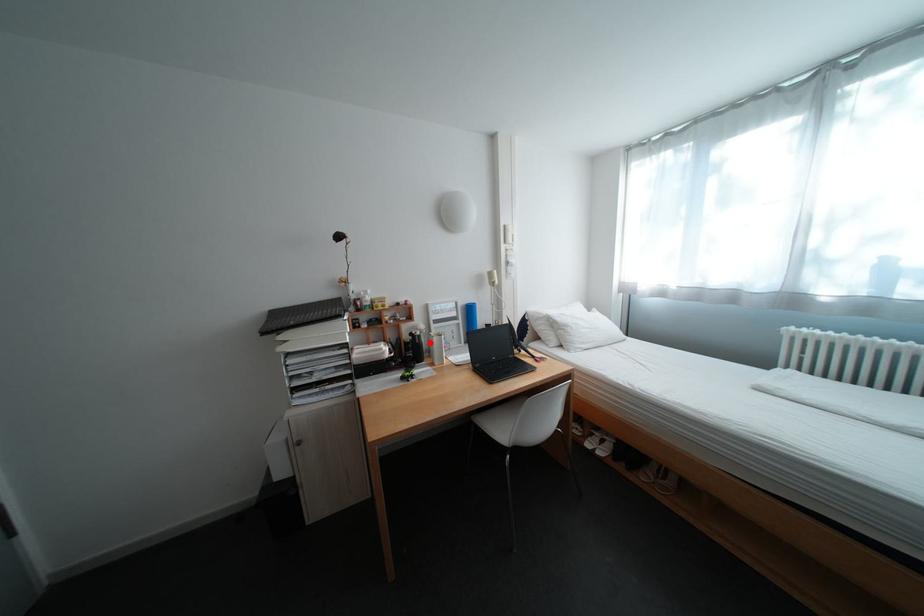
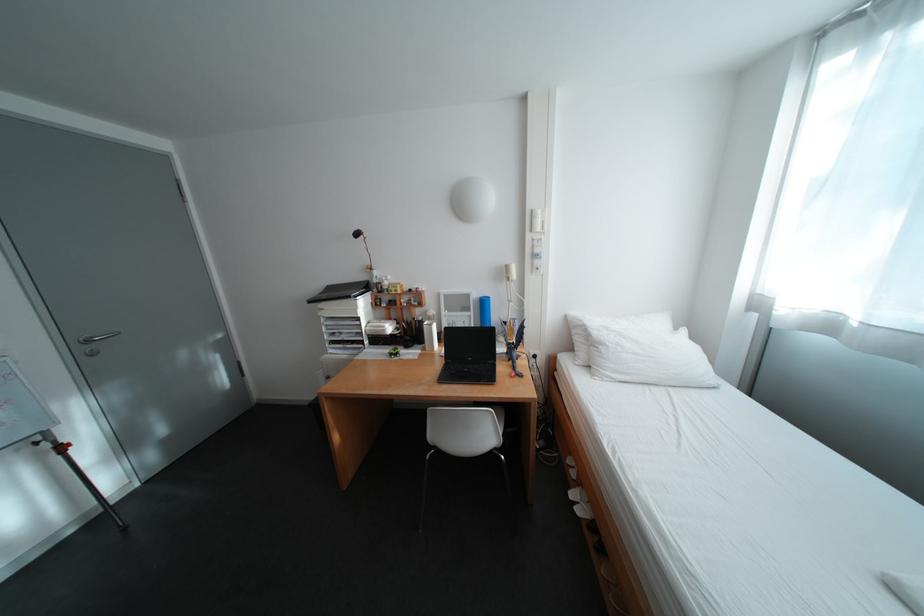
Locate, in the second image, the point that corresponds to the highlighted location in the first image.

(430, 326)